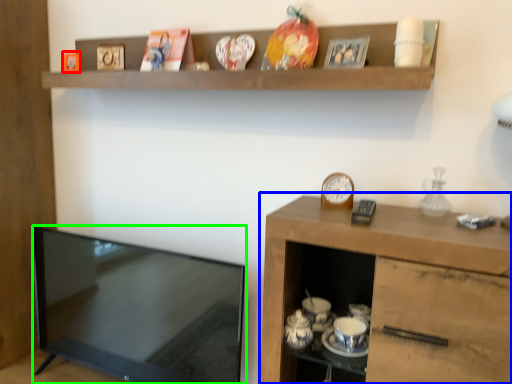
Question: Considering the real-world distances, which object is farthest from picture frame (highlighted by a red box)? cabinetry (highlighted by a blue box) or television (highlighted by a green box)?

Choices:
 (A) cabinetry
 (B) television

Answer: (A)